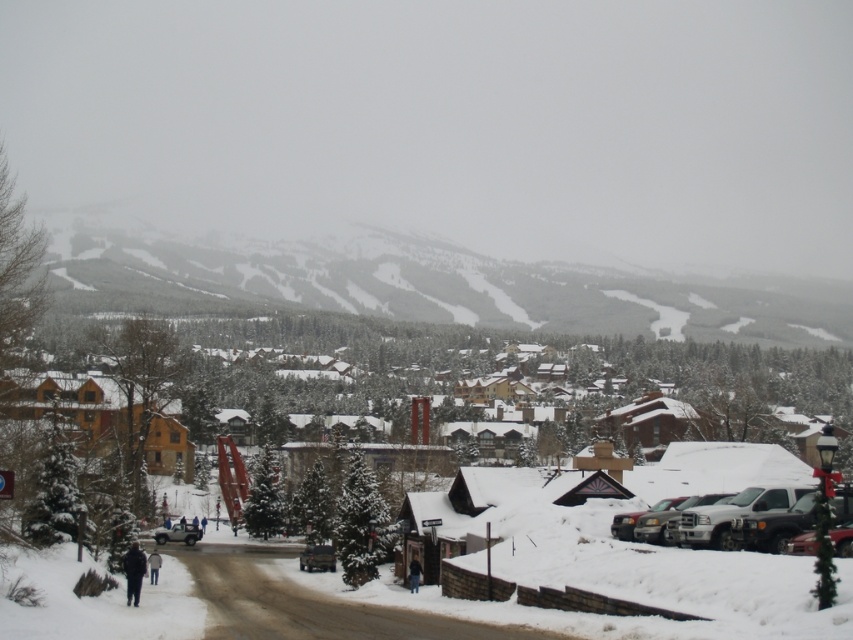
Question: Estimate the real-world distances between objects in this image. Which object is closer to the metallic silver car at center?

Choices:
 (A) metallic silver truck at lower right
 (B) silver metallic suv at center

Answer: (B)

Question: Considering the relative positions of metallic silver truck at lower right and metallic silver car at center in the image provided, where is metallic silver truck at lower right located with respect to metallic silver car at center?

Choices:
 (A) below
 (B) above

Answer: (B)

Question: Can you confirm if metallic silver truck at lower right is thinner than silver metallic suv at center?

Choices:
 (A) no
 (B) yes

Answer: (A)

Question: Which of these objects is positioned farthest from the silver metallic suv at center?

Choices:
 (A) metallic silver car at center
 (B) metallic silver truck at lower right

Answer: (B)

Question: Which point appears closest to the camera in this image?

Choices:
 (A) (828, 499)
 (B) (193, 536)
 (C) (299, 561)

Answer: (A)

Question: From the image, what is the correct spatial relationship of metallic silver truck at lower right in relation to silver metallic suv at center?

Choices:
 (A) above
 (B) below

Answer: (A)